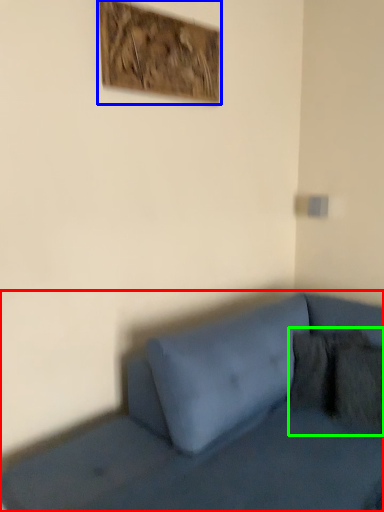
Question: Based on their relative distances, which object is farther from studio couch (highlighted by a red box)? Choose from picture frame (highlighted by a blue box) and pillow (highlighted by a green box).

Choices:
 (A) picture frame
 (B) pillow

Answer: (A)